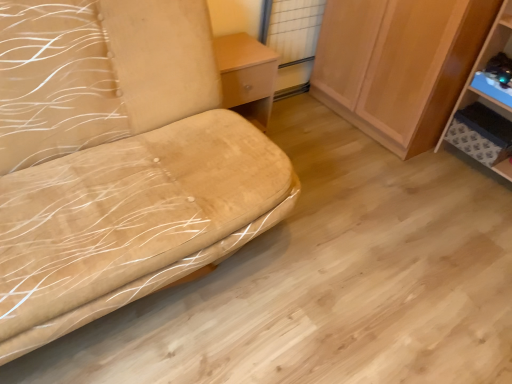
Where is `vacant space that is in between wooden cabinet at right and blue plastic shelf at right`? vacant space that is in between wooden cabinet at right and blue plastic shelf at right is located at coordinates tap(447, 173).